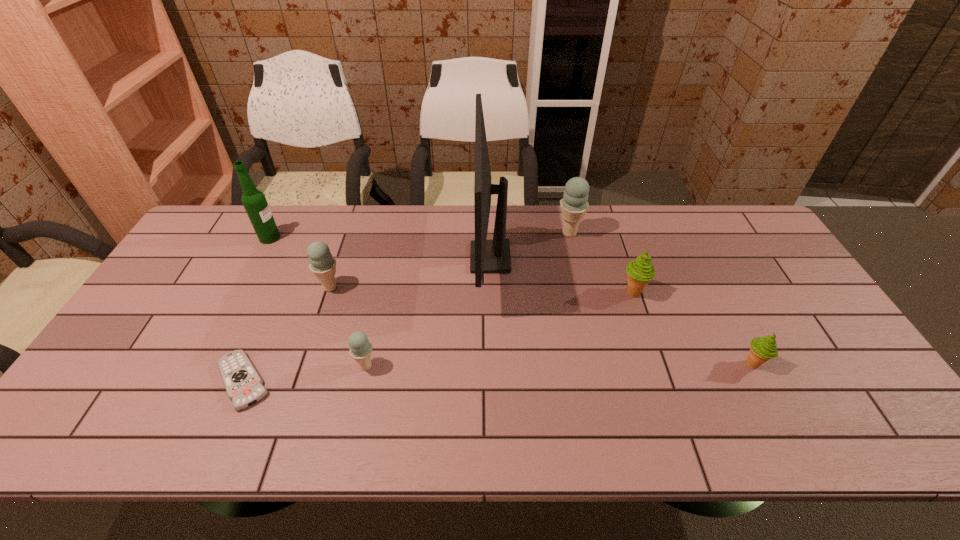
You are a GUI agent. You are given a task and a screenshot of the screen. Output one action in this format:
    pyautogui.click(x=<x>, y=<y>)
    Task: Click on the vacant position located on the back of the biggest blue ice cream
    Image resolution: width=960 pixels, height=540 pixels.
    Given the screenshot: What is the action you would take?
    pyautogui.click(x=564, y=207)

Where is `vacant area located 0.330m on the left of the left green icecream`? Image resolution: width=960 pixels, height=540 pixels. vacant area located 0.330m on the left of the left green icecream is located at coordinates (506, 293).

Locate an element on the screen. The height and width of the screenshot is (540, 960). blank space located 0.130m on the right of the leftmost icecream is located at coordinates (387, 287).

You are a GUI agent. You are given a task and a screenshot of the screen. Output one action in this format:
    pyautogui.click(x=<x>, y=<y>)
    Task: Click on the vacant space located on the left of the nearest blue ice cream
    
    Given the screenshot: What is the action you would take?
    click(335, 366)

I want to click on free space located on the back of the right green icecream, so click(720, 302).

Where is `vacant space located on the left of the remote control`? The image size is (960, 540). vacant space located on the left of the remote control is located at coordinates (143, 381).

This screenshot has width=960, height=540. I want to click on computer monitor that is at the far edge, so click(493, 256).

The width and height of the screenshot is (960, 540). Find the location of `beer bottle at the far edge`. beer bottle at the far edge is located at coordinates (254, 201).

Locate an element on the screen. The image size is (960, 540). ice cream that is at the far edge is located at coordinates (574, 205).

You are a GUI agent. You are given a task and a screenshot of the screen. Output one action in this format:
    pyautogui.click(x=<x>, y=<y>)
    Task: Click on the object that is at the near edge
    
    Given the screenshot: What is the action you would take?
    pyautogui.click(x=243, y=384)